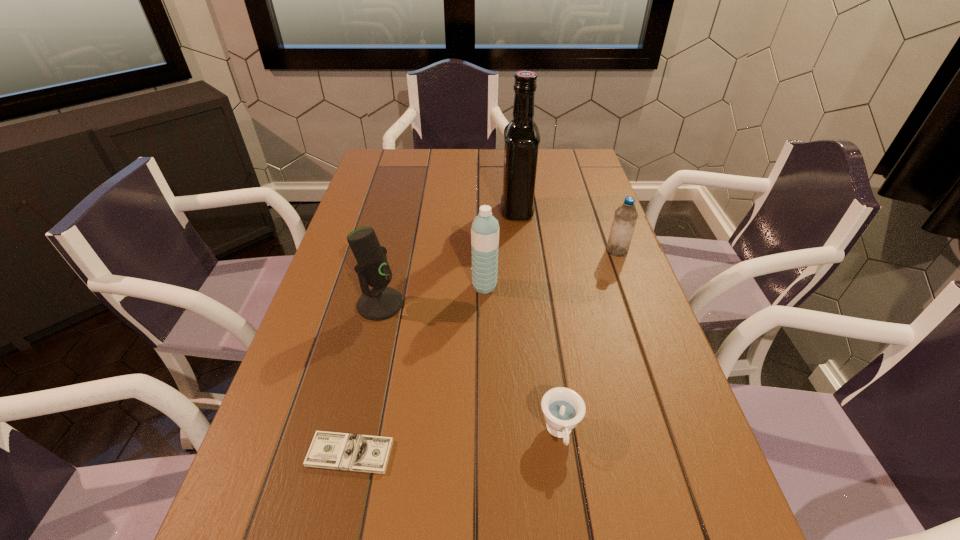
This screenshot has width=960, height=540. I want to click on vacant space positioned 0.250m on the front-facing side of the farthest object, so click(420, 210).

The image size is (960, 540). Find the location of `free spot located 0.080m on the front-facing side of the farthest object`. free spot located 0.080m on the front-facing side of the farthest object is located at coordinates (475, 210).

This screenshot has height=540, width=960. I want to click on free space located 0.120m on the right of the left water bottle, so click(x=545, y=286).

Find the location of a particular element. Image resolution: width=960 pixels, height=540 pixels. vacant space located on the right of the microphone is located at coordinates (544, 304).

This screenshot has height=540, width=960. Find the location of `vacant space located on the left of the shorter water bottle`. vacant space located on the left of the shorter water bottle is located at coordinates (476, 251).

Find the location of a particular element. The height and width of the screenshot is (540, 960). vacant space positioned 0.050m on the side of the teacup with the handle is located at coordinates (567, 488).

Image resolution: width=960 pixels, height=540 pixels. In order to click on free space located 0.130m on the right of the dollar in this screenshot , I will do `click(464, 453)`.

This screenshot has height=540, width=960. I want to click on microphone at the left edge, so click(381, 302).

Where is `dollar that is at the left edge`? dollar that is at the left edge is located at coordinates (343, 451).

This screenshot has height=540, width=960. In order to click on object that is at the right edge in this screenshot , I will do `click(625, 217)`.